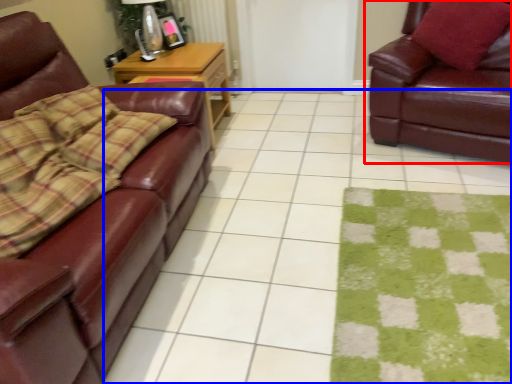
Question: Among these objects, which one is nearest to the camera, studio couch (highlighted by a red box) or square (highlighted by a blue box)?

Choices:
 (A) studio couch
 (B) square

Answer: (B)